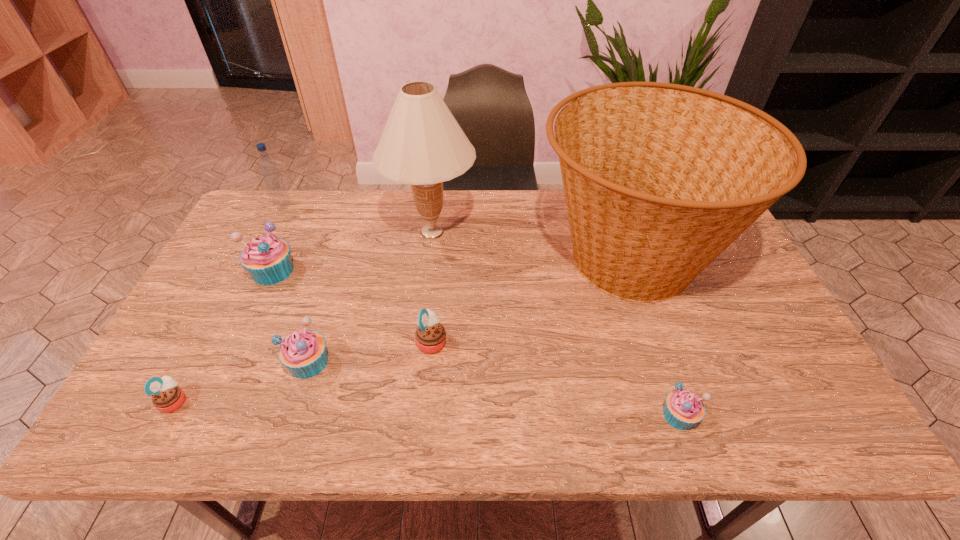
Find the location of a particular element. vacant area that lies between the nearer pink muffin and the rightmost muffin is located at coordinates (427, 408).

This screenshot has width=960, height=540. I want to click on unoccupied area between the second blue muffin from right to left and the smaller pink muffin, so click(x=242, y=381).

Where is `vacant area between the basket and the blue water bottle`? vacant area between the basket and the blue water bottle is located at coordinates (456, 232).

Where is `empty space that is in between the tallest muffin and the lampshade`? Image resolution: width=960 pixels, height=540 pixels. empty space that is in between the tallest muffin and the lampshade is located at coordinates (352, 251).

Where is `object that can be found as the third closest to the rightmost muffin`? The image size is (960, 540). object that can be found as the third closest to the rightmost muffin is located at coordinates (422, 144).

Choose which object is the third nearest neighbor to the left pink muffin. Please provide its 2D coordinates. Your answer should be formatted as a tuple, i.e. [(x, y)], where the tuple contains the x and y coordinates of a point satisfying the conditions above.

[(430, 336)]

Identify which muffin is the third closest to the farthest muffin. Please provide its 2D coordinates. Your answer should be formatted as a tuple, i.e. [(x, y)], where the tuple contains the x and y coordinates of a point satisfying the conditions above.

[(430, 336)]

Identify which muffin is the fourth nearest to the bigger pink muffin. Please provide its 2D coordinates. Your answer should be formatted as a tuple, i.e. [(x, y)], where the tuple contains the x and y coordinates of a point satisfying the conditions above.

[(167, 397)]

Choose which blue muffin is the second nearest neighbor to the lampshade. Please provide its 2D coordinates. Your answer should be formatted as a tuple, i.e. [(x, y)], where the tuple contains the x and y coordinates of a point satisfying the conditions above.

[(303, 352)]

Find the location of a particular element. blue muffin that stands as the closest to the lampshade is located at coordinates 267,258.